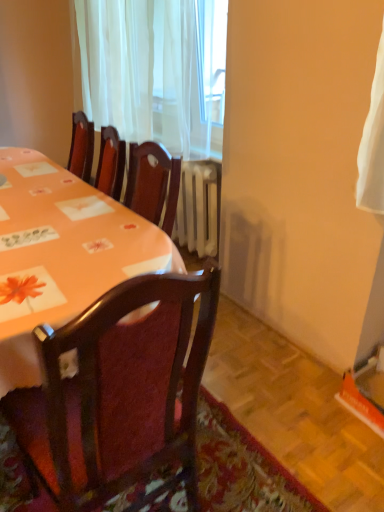
Question: In terms of size, does wooden chair at center appear bigger or smaller than white sheer curtain at upper center?

Choices:
 (A) big
 (B) small

Answer: (B)

Question: From the image's perspective, is wooden chair at center above or below white sheer curtain at upper center?

Choices:
 (A) below
 (B) above

Answer: (A)

Question: Estimate the real-world distances between objects in this image. Which object is closer to the wooden chair at center?

Choices:
 (A) orange fabric table at upper left
 (B) white sheer curtain at upper center

Answer: (A)

Question: Considering the real-world distances, which object is farthest from the wooden chair at center?

Choices:
 (A) orange fabric table at upper left
 (B) white sheer curtain at upper center

Answer: (B)